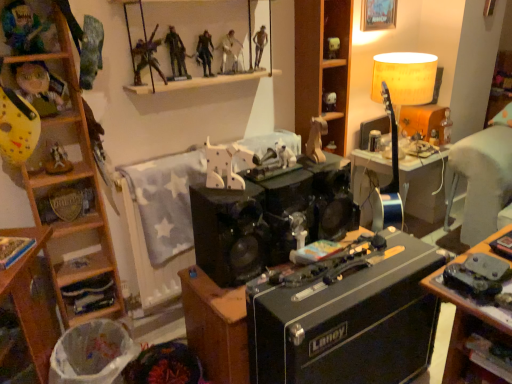
Question: Should I look upward or downward to see matte white skull at upper center, which is the 1th toy from right to left?

Choices:
 (A) down
 (B) up

Answer: (B)

Question: Does wooden shelves at lower left, which appears as the 1th shelf when ordered from the bottom, appear on the left side of smooth white figure at upper center, which is the 2th person from right to left?

Choices:
 (A) no
 (B) yes

Answer: (B)

Question: Is wooden shelves at lower left, positioned as the third shelf in right-to-left order, not within smooth white figure at upper center, which is the 6th person in left-to-right order?

Choices:
 (A) yes
 (B) no

Answer: (A)

Question: Considering the relative sizes of wooden shelves at lower left, positioned as the third shelf in right-to-left order, and smooth white figure at upper center, which is the 2th person from right to left, in the image provided, is wooden shelves at lower left, positioned as the third shelf in right-to-left order, taller than smooth white figure at upper center, which is the 2th person from right to left,?

Choices:
 (A) no
 (B) yes

Answer: (A)

Question: Considering the relative sizes of wooden shelves at lower left, which is the first shelf from left to right, and smooth white figure at upper center, which is the 2th person from right to left, in the image provided, is wooden shelves at lower left, which is the first shelf from left to right, smaller than smooth white figure at upper center, which is the 2th person from right to left,?

Choices:
 (A) yes
 (B) no

Answer: (B)

Question: Does wooden shelves at lower left, which is the first shelf from left to right, have a greater width compared to smooth white figure at upper center, which is the 6th person in left-to-right order?

Choices:
 (A) yes
 (B) no

Answer: (A)

Question: Is wooden shelves at lower left, the third shelf viewed from the top, closer to camera compared to smooth white figure at upper center, which is the 6th person in left-to-right order?

Choices:
 (A) yes
 (B) no

Answer: (A)

Question: From the image's perspective, is wooden horse at center, which is the 1th toy in front-to-back order, located above matte white skull at upper center, which is the 1th toy from right to left?

Choices:
 (A) no
 (B) yes

Answer: (A)

Question: Is wooden horse at center, which ranks as the 5th toy in top-to-bottom order, wider than matte white skull at upper center, which appears as the second toy when viewed from the top?

Choices:
 (A) yes
 (B) no

Answer: (A)

Question: Is wooden horse at center, which is the 1th toy in front-to-back order, oriented away from matte white skull at upper center, the 1th toy when ordered from back to front?

Choices:
 (A) no
 (B) yes

Answer: (A)

Question: From a real-world perspective, is wooden horse at center, the 2th toy in the left-to-right sequence, positioned over matte white skull at upper center, marked as the 4th toy in a bottom-to-top arrangement, based on gravity?

Choices:
 (A) no
 (B) yes

Answer: (A)

Question: Does wooden horse at center, which appears as the fourth toy when viewed from the right, appear on the left side of matte white skull at upper center, acting as the 5th toy starting from the left?

Choices:
 (A) yes
 (B) no

Answer: (A)

Question: Is there a large distance between wooden horse at center, the 5th toy from the back, and matte white skull at upper center, acting as the 5th toy starting from the left?

Choices:
 (A) yes
 (B) no

Answer: (B)

Question: Would you say matte yellow lampshade at upper right is part of white plastic trash bin at lower left's contents?

Choices:
 (A) no
 (B) yes

Answer: (A)